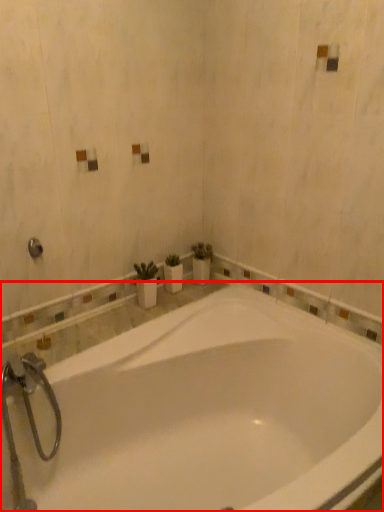
Question: From the image's perspective, where is bathtub (annotated by the red box) located in relation to shower in the image?

Choices:
 (A) above
 (B) below

Answer: (B)